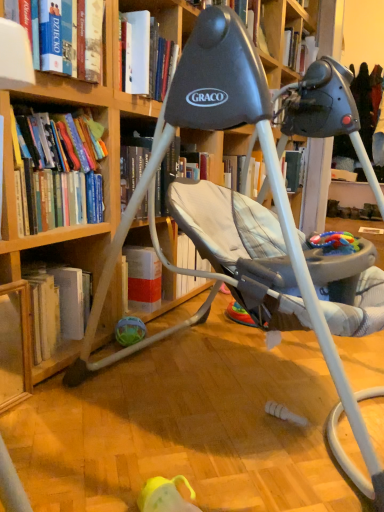
Where is `vacant space underneath wooden bookcase at center (from a real-world perspective)`? Image resolution: width=384 pixels, height=512 pixels. vacant space underneath wooden bookcase at center (from a real-world perspective) is located at coordinates (248, 390).